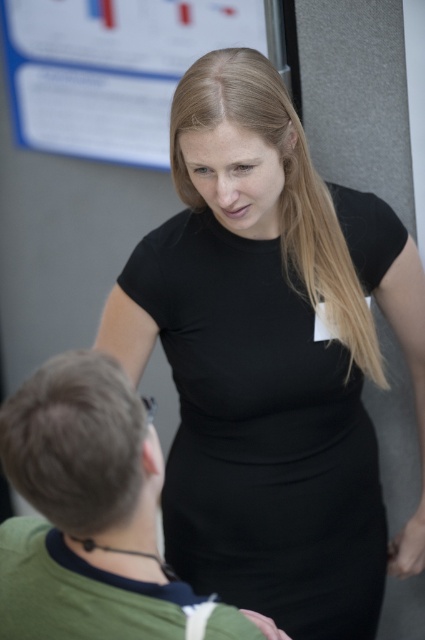
This screenshot has height=640, width=425. Describe the element at coordinates (87, 504) in the screenshot. I see `green matte shirt at lower left` at that location.

From the picture: Which is more to the left, green matte shirt at lower left or blue paper at upper center?

blue paper at upper center is more to the left.

Looking at this image, measure the distance between green matte shirt at lower left and camera.

The distance of green matte shirt at lower left from camera is 32.84 inches.

Where is `green matte shirt at lower left`? The width and height of the screenshot is (425, 640). green matte shirt at lower left is located at coordinates (87, 504).

Is black matte dress at center below blue paper at upper center?

Correct, black matte dress at center is located below blue paper at upper center.

Does black matte dress at center appear on the left side of blue paper at upper center?

No, black matte dress at center is not to the left of blue paper at upper center.

Who is more distant from viewer, (209, 548) or (122, 88)?

Point (122, 88)

Where is `black matte dress at center`? black matte dress at center is located at coordinates (261, 436).

Does black matte dress at center appear on the left side of green matte shirt at lower left?

No, black matte dress at center is not to the left of green matte shirt at lower left.

Describe the element at coordinates (261, 436) in the screenshot. I see `black matte dress at center` at that location.

What do you see at coordinates (261, 436) in the screenshot? Image resolution: width=425 pixels, height=640 pixels. I see `black matte dress at center` at bounding box center [261, 436].

Find the location of `black matte dress at center`. black matte dress at center is located at coordinates (261, 436).